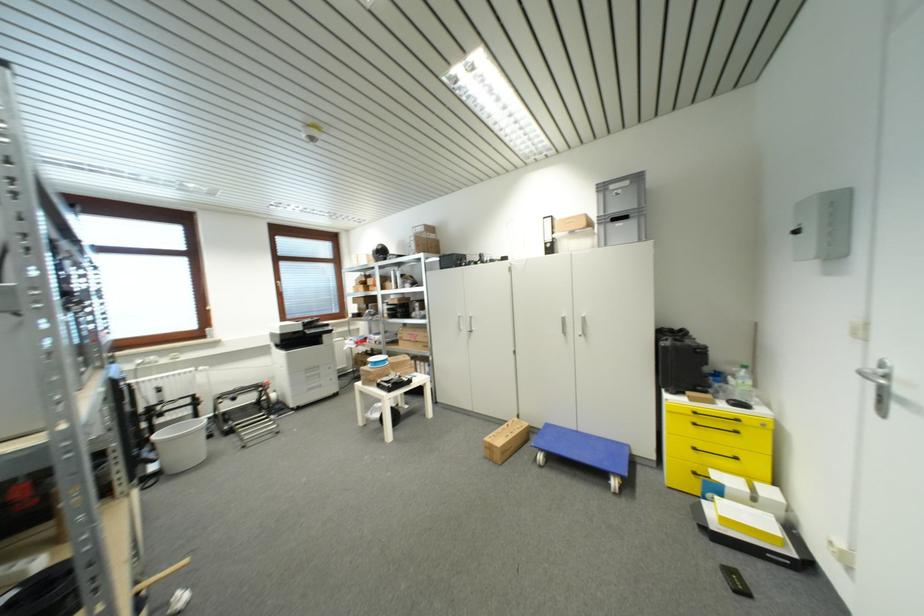
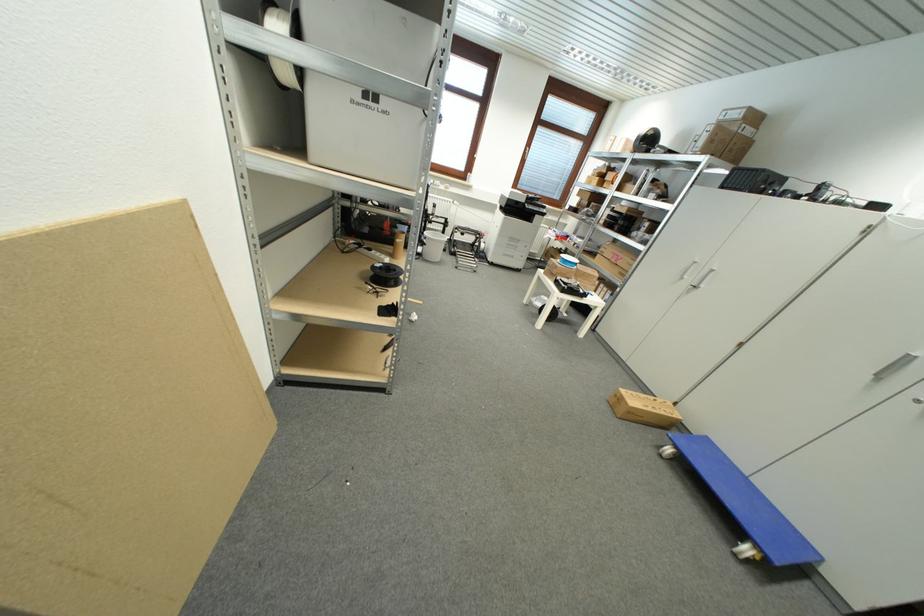
The point at (157,435) is marked in the first image. Where is the corresponding point in the second image?

(430, 233)